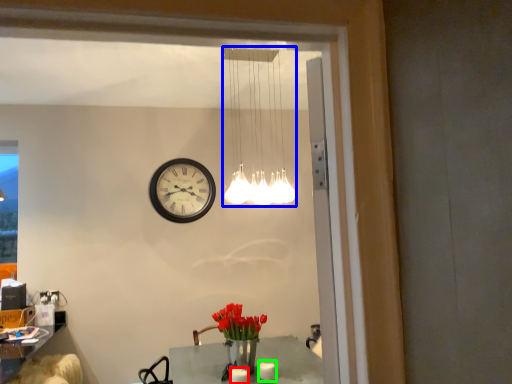
Question: Estimate the real-world distances between objects in this image. Which object is closer to candle (highlighted by a red box), lamp (highlighted by a blue box) or candle (highlighted by a green box)?

Choices:
 (A) lamp
 (B) candle

Answer: (B)